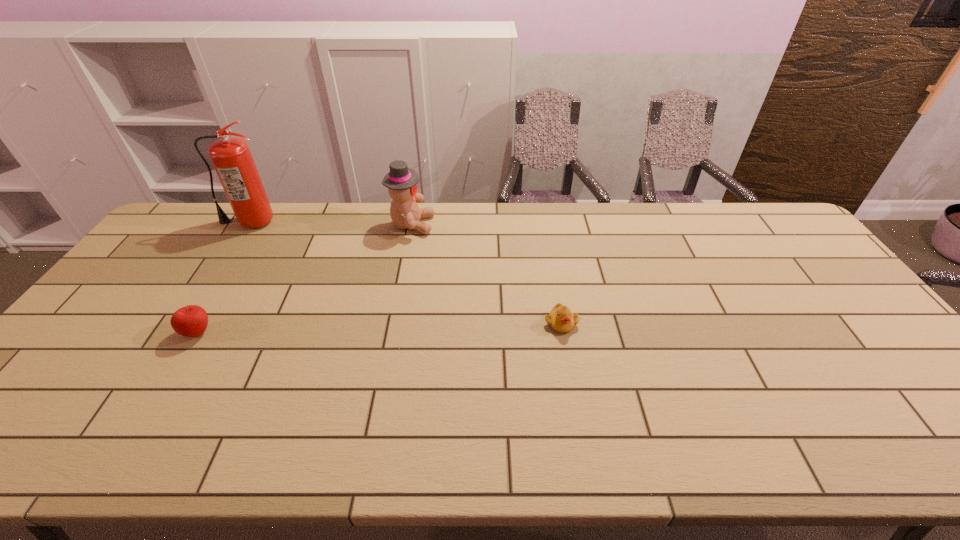
Image resolution: width=960 pixels, height=540 pixels. In order to click on free location that satisfies the following two spatial constraints: 1. on the instruction side of the tallest object; 2. on the left side of the third tallest object in this screenshot , I will do `click(178, 332)`.